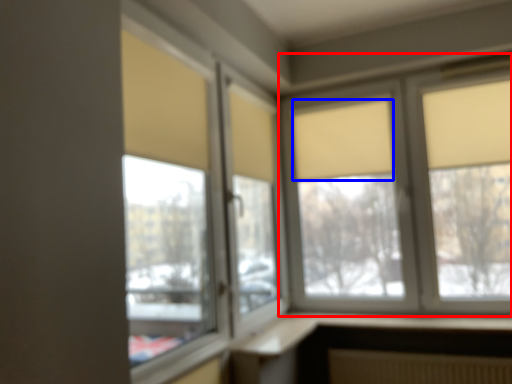
Question: Which of the following is the farthest to the observer, window (highlighted by a red box) or curtain (highlighted by a blue box)?

Choices:
 (A) window
 (B) curtain

Answer: (B)